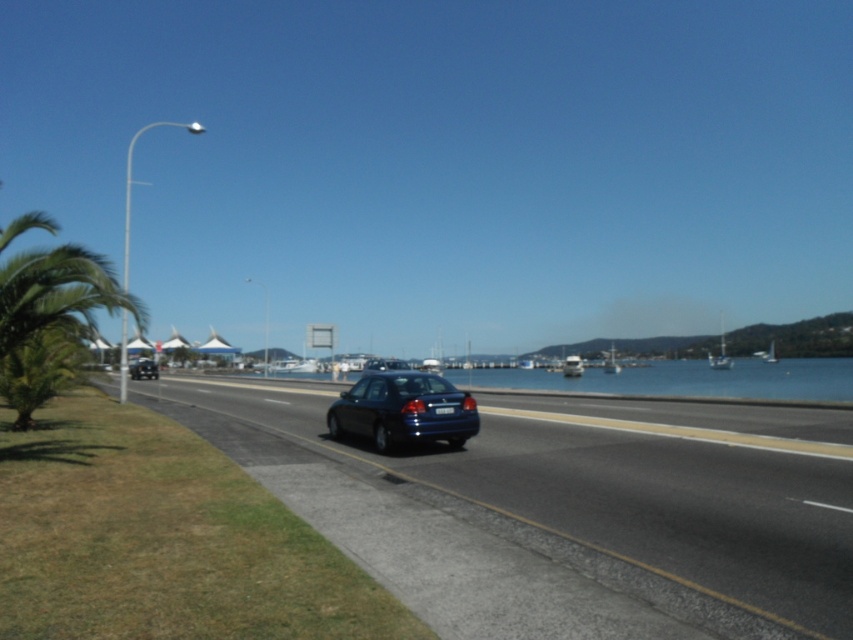
You are a driver trying to park your car in the parking lot near the glossy blue car at center and the glossy blue sedan at center. Which vehicle takes up more space in the parking spot?

The glossy blue car at center takes up more space in the parking spot because its width is larger than the glossy blue sedan at center.

You are a traffic officer checking if the glossy blue sedan at center has a visible license plate. Based on the scene, can you confirm if the black plastic license plate at center is visible from your viewpoint?

The glossy blue sedan at center is in front of the black plastic license plate at center, so the license plate might be obscured and not fully visible from the officer viewpoint.

You are a pedestrian standing on the grassy area near the palm tree. You see a glossy blue car at center and a glossy blue sedan at center on the coastal road. Which vehicle is closer to the water?

The glossy blue sedan at center is closer to the water because it is above the glossy blue car at center, which would place it nearer to the right side of the frame where the water is located.